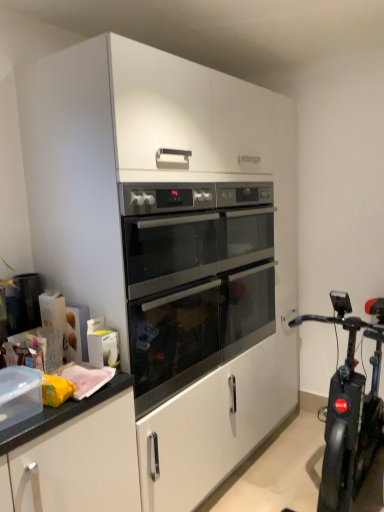
Locate an element on the screen. The width and height of the screenshot is (384, 512). black glossy stationary bicycle at right is located at coordinates [350, 409].

Describe the element at coordinates (350, 409) in the screenshot. The image size is (384, 512). I see `black glossy stationary bicycle at right` at that location.

Measure the distance between black glossy stationary bicycle at right and camera.

The distance of black glossy stationary bicycle at right from camera is 1.83 meters.

Find the location of `stainless steel oven at center`. stainless steel oven at center is located at coordinates (195, 279).

Describe the element at coordinates (195, 279) in the screenshot. I see `stainless steel oven at center` at that location.

What is the approximate height of stainless steel oven at center?

It is 35.63 inches.

Find the location of a particular element. This screenshot has width=384, height=512. black glossy stationary bicycle at right is located at coordinates (350, 409).

Considering the positions of objects stainless steel oven at center and black glossy stationary bicycle at right in the image provided, who is more to the left, stainless steel oven at center or black glossy stationary bicycle at right?

stainless steel oven at center is more to the left.

Between stainless steel oven at center and black glossy stationary bicycle at right, which one is positioned behind?

stainless steel oven at center is behind.

Between point (143, 311) and point (335, 481), which one is positioned in front?

Positioned in front is point (143, 311).

From the image's perspective, does stainless steel oven at center appear lower than black glossy stationary bicycle at right?

No, from the image's perspective, stainless steel oven at center is not beneath black glossy stationary bicycle at right.

From a real-world perspective, who is located lower, stainless steel oven at center or black glossy stationary bicycle at right?

black glossy stationary bicycle at right.

Considering the sizes of stainless steel oven at center and black glossy stationary bicycle at right in the image, is stainless steel oven at center wider or thinner than black glossy stationary bicycle at right?

In the image, stainless steel oven at center appears to be more narrow than black glossy stationary bicycle at right.

Between stainless steel oven at center and black glossy stationary bicycle at right, which one has more height?

black glossy stationary bicycle at right is taller.

Considering the sizes of stainless steel oven at center and black glossy stationary bicycle at right in the image, is stainless steel oven at center bigger or smaller than black glossy stationary bicycle at right?

Considering their sizes, stainless steel oven at center takes up less space than black glossy stationary bicycle at right.

Is stainless steel oven at center spatially inside black glossy stationary bicycle at right, or outside of it?

The correct answer is: outside.

Is stainless steel oven at center not close to black glossy stationary bicycle at right?

That's not correct — stainless steel oven at center is a little close to black glossy stationary bicycle at right.

Is black glossy stationary bicycle at right at the back of stainless steel oven at center?

No.

Can you tell me how much stainless steel oven at center and black glossy stationary bicycle at right differ in facing direction?

They differ by 91.4 degrees in their facing directions.

Looking at this image, measure the distance between stainless steel oven at center and black glossy stationary bicycle at right.

stainless steel oven at center is 28.24 inches from black glossy stationary bicycle at right.

You are a GUI agent. You are given a task and a screenshot of the screen. Output one action in this format:
    pyautogui.click(x=<x>, y=<y>)
    Task: Click on the stationary bicycle in front of the stainless steel oven at center
    The image size is (384, 512).
    Given the screenshot: What is the action you would take?
    pyautogui.click(x=350, y=409)

Between black glossy stationary bicycle at right and stainless steel oven at center, which one appears on the left side from the viewer's perspective?

From the viewer's perspective, stainless steel oven at center appears more on the left side.

Which object is closer to the camera taking this photo, black glossy stationary bicycle at right or stainless steel oven at center?

black glossy stationary bicycle at right is in front.

Is point (329, 443) closer or farther from the camera than point (228, 339)?

Point (329, 443).

From the image's perspective, which is above, black glossy stationary bicycle at right or stainless steel oven at center?

stainless steel oven at center appears higher in the image.

From a real-world perspective, who is located higher, black glossy stationary bicycle at right or stainless steel oven at center?

From a 3D spatial view, stainless steel oven at center is above.

Considering the relative sizes of black glossy stationary bicycle at right and stainless steel oven at center in the image provided, is black glossy stationary bicycle at right thinner than stainless steel oven at center?

In fact, black glossy stationary bicycle at right might be wider than stainless steel oven at center.

Considering the relative sizes of black glossy stationary bicycle at right and stainless steel oven at center in the image provided, is black glossy stationary bicycle at right shorter than stainless steel oven at center?

In fact, black glossy stationary bicycle at right may be taller than stainless steel oven at center.

Is black glossy stationary bicycle at right bigger than stainless steel oven at center?

Yes, black glossy stationary bicycle at right is bigger than stainless steel oven at center.

Is black glossy stationary bicycle at right inside the boundaries of stainless steel oven at center, or outside?

The correct answer is: outside.

Is black glossy stationary bicycle at right placed right next to stainless steel oven at center?

No, black glossy stationary bicycle at right is not touching stainless steel oven at center.

Is black glossy stationary bicycle at right facing away from stainless steel oven at center?

No, stainless steel oven at center is not at the back of black glossy stationary bicycle at right.

Identify the location of oven on the left of black glossy stationary bicycle at right. The width and height of the screenshot is (384, 512). (195, 279).

Where is `oven behind the black glossy stationary bicycle at right`? This screenshot has width=384, height=512. oven behind the black glossy stationary bicycle at right is located at coordinates (195, 279).

Image resolution: width=384 pixels, height=512 pixels. In order to click on oven on the left of the black glossy stationary bicycle at right in this screenshot , I will do `click(195, 279)`.